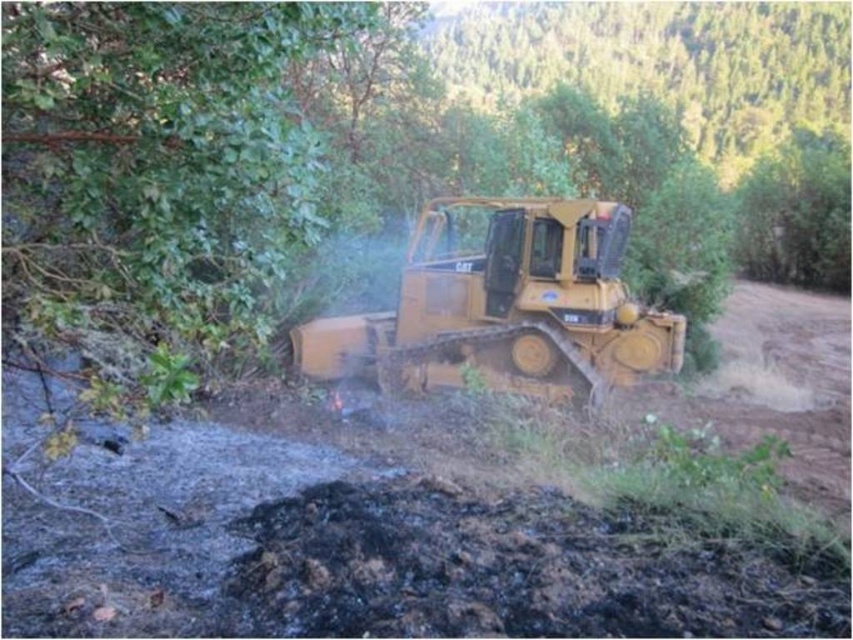
Question: Where is charcoal soil at lower center located in relation to matte yellow tractor at center in the image?

Choices:
 (A) right
 (B) left

Answer: (B)

Question: Does charcoal soil at lower center have a greater width compared to matte yellow tractor at center?

Choices:
 (A) yes
 (B) no

Answer: (B)

Question: Among these objects, which one is farthest from the camera?

Choices:
 (A) charcoal soil at lower center
 (B) matte yellow tractor at center

Answer: (B)

Question: Does charcoal soil at lower center have a smaller size compared to matte yellow tractor at center?

Choices:
 (A) no
 (B) yes

Answer: (B)